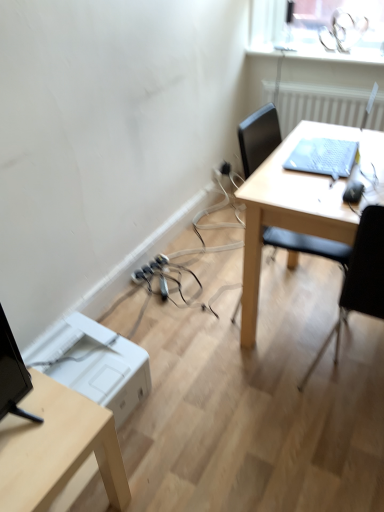
Question: Does white textured radiator at upper right have a lesser width compared to light wood desk at lower left?

Choices:
 (A) no
 (B) yes

Answer: (B)

Question: From a real-world perspective, is white textured radiator at upper right beneath light wood desk at lower left?

Choices:
 (A) yes
 (B) no

Answer: (B)

Question: Is white textured radiator at upper right wider than light wood desk at lower left?

Choices:
 (A) yes
 (B) no

Answer: (B)

Question: Is white textured radiator at upper right oriented towards light wood desk at lower left?

Choices:
 (A) yes
 (B) no

Answer: (B)

Question: Is white textured radiator at upper right far away from light wood desk at lower left?

Choices:
 (A) no
 (B) yes

Answer: (B)

Question: Is white textured radiator at upper right with light wood desk at lower left?

Choices:
 (A) yes
 (B) no

Answer: (B)

Question: Does white textured radiator at upper right touch black plastic extension cord at lower center?

Choices:
 (A) yes
 (B) no

Answer: (B)

Question: From the image's perspective, is white textured radiator at upper right below black plastic extension cord at lower center?

Choices:
 (A) no
 (B) yes

Answer: (A)

Question: Considering the relative positions of white textured radiator at upper right and black plastic extension cord at lower center in the image provided, is white textured radiator at upper right to the left of black plastic extension cord at lower center from the viewer's perspective?

Choices:
 (A) yes
 (B) no

Answer: (B)

Question: Considering the relative sizes of white textured radiator at upper right and black plastic extension cord at lower center in the image provided, is white textured radiator at upper right thinner than black plastic extension cord at lower center?

Choices:
 (A) no
 (B) yes

Answer: (A)

Question: From the image's perspective, would you say white textured radiator at upper right is positioned over black plastic extension cord at lower center?

Choices:
 (A) yes
 (B) no

Answer: (A)

Question: Is white textured radiator at upper right bigger than black plastic extension cord at lower center?

Choices:
 (A) yes
 (B) no

Answer: (A)

Question: Is black plastic chair at right a part of black plastic extension cord at lower center?

Choices:
 (A) no
 (B) yes

Answer: (A)